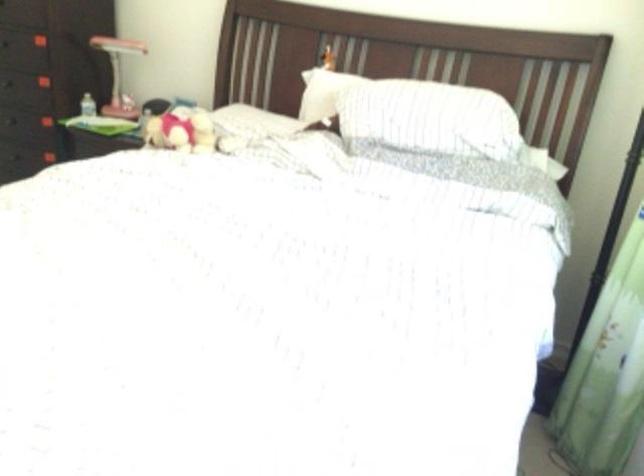
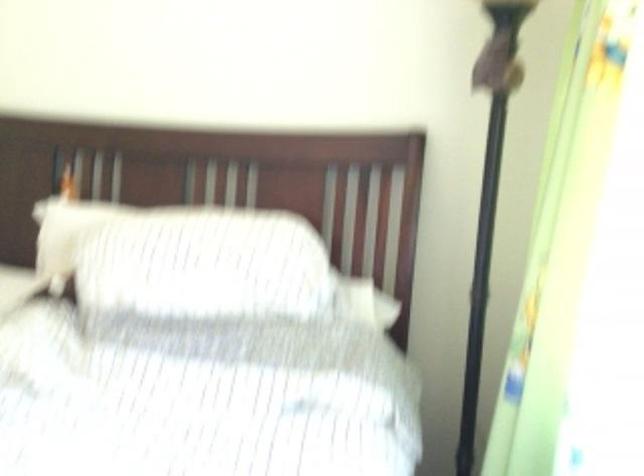
Question: The images are taken continuously from a first-person perspective. In which direction is your viewpoint rotating?

Choices:
 (A) Left
 (B) Right
 (C) Up
 (D) Down

Answer: (B)